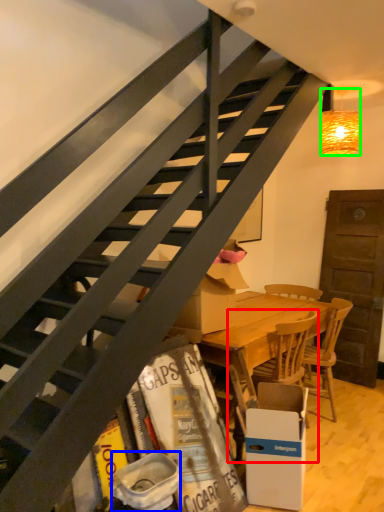
Question: Considering the real-world distances, which object is farthest from chair (highlighted by a red box)? trash bin/can (highlighted by a blue box) or lamp (highlighted by a green box)?

Choices:
 (A) trash bin/can
 (B) lamp

Answer: (B)